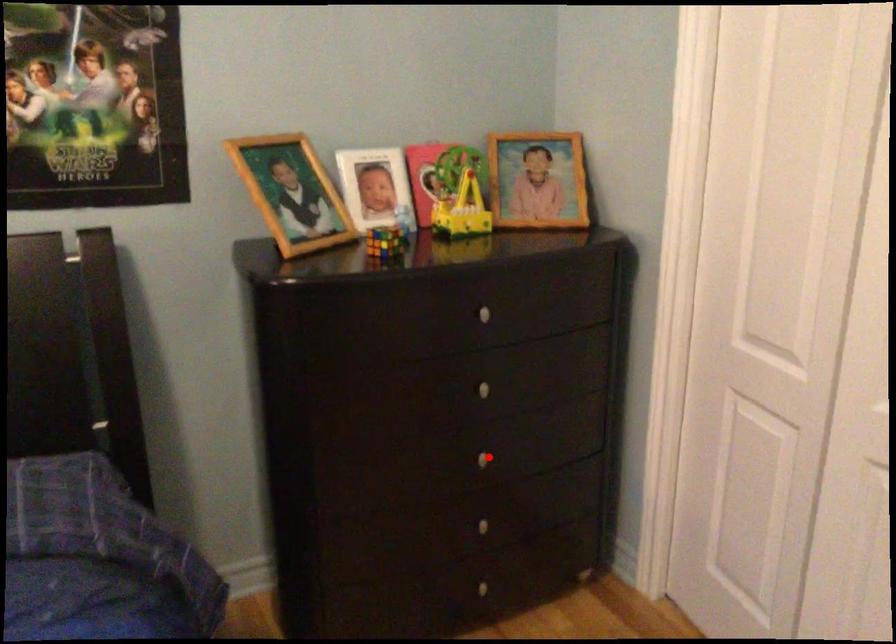
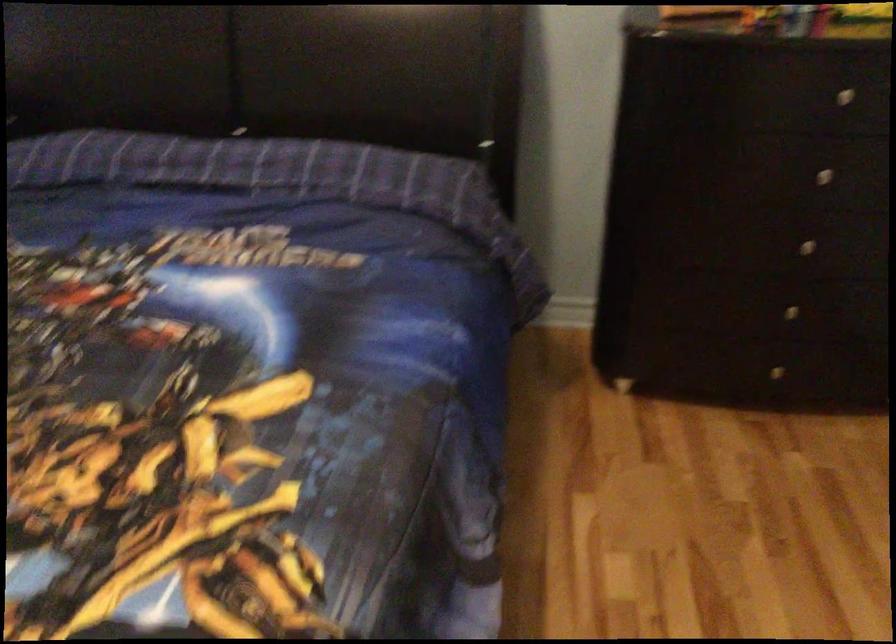
In the second image, find the point that corresponds to the highlighted location in the first image.

(805, 245)